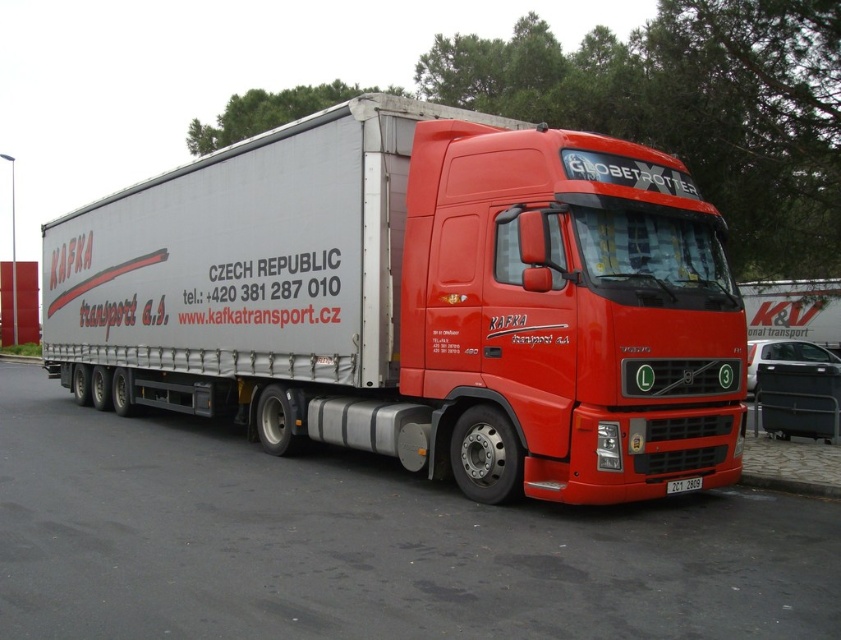
Is metallic silver trailer at center below matte white trailer at center?

No, metallic silver trailer at center is not below matte white trailer at center.

What do you see at coordinates (419, 301) in the screenshot? The width and height of the screenshot is (841, 640). I see `metallic silver trailer at center` at bounding box center [419, 301].

Find the location of a particular element. The height and width of the screenshot is (640, 841). metallic silver trailer at center is located at coordinates (419, 301).

At what (x,y) coordinates should I click in order to perform the action: click on metallic silver trailer at center. Please return your answer as a coordinate pair (x, y). Looking at the image, I should click on (419, 301).

Is point (315, 465) positioned behind point (693, 490)?

Yes, point (315, 465) is behind point (693, 490).

Is matte white trailer at center closer to camera compared to black plastic license plate at bottom center?

Yes, matte white trailer at center is closer to the viewer.

Where is `matte white trailer at center`? The image size is (841, 640). matte white trailer at center is located at coordinates (366, 545).

Can you confirm if metallic silver trailer at center is positioned to the left of black plastic license plate at bottom center?

Correct, you'll find metallic silver trailer at center to the left of black plastic license plate at bottom center.

Does metallic silver trailer at center come behind black plastic license plate at bottom center?

No, metallic silver trailer at center is closer to the viewer.

You are a GUI agent. You are given a task and a screenshot of the screen. Output one action in this format:
    pyautogui.click(x=<x>, y=<y>)
    Task: Click on the metallic silver trailer at center
    
    Given the screenshot: What is the action you would take?
    pyautogui.click(x=419, y=301)